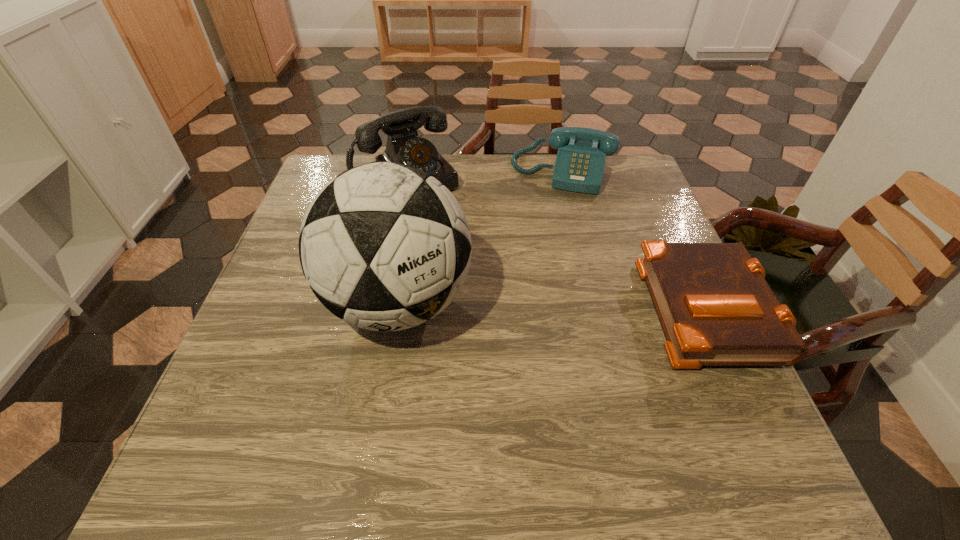
The height and width of the screenshot is (540, 960). Identify the location of free space that satisfies the following two spatial constraints: 1. on the surface of the tallest object where the brand logo is visible; 2. on the spine side of the shortest object. (398, 307).